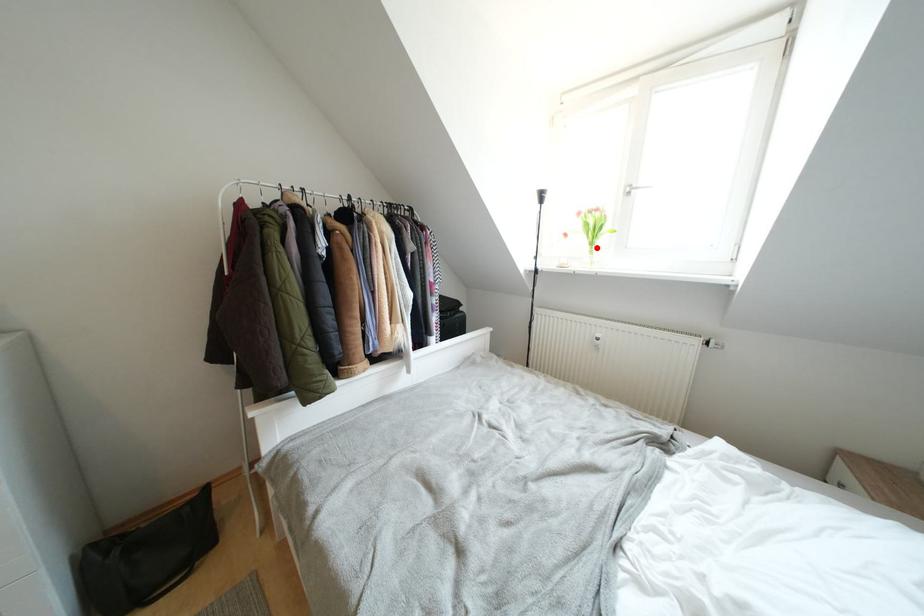
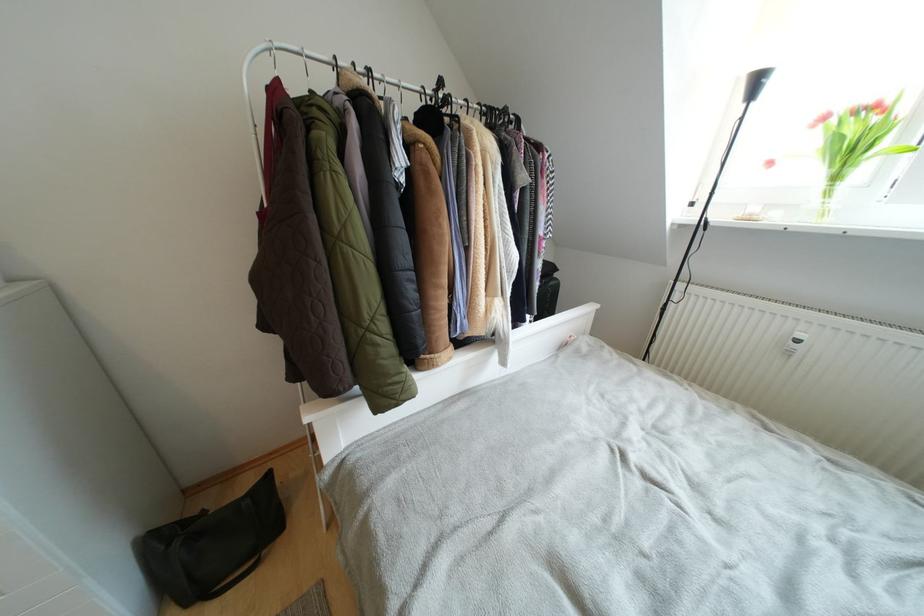
The point at the highlighted location is marked in the first image. Where is the corresponding point in the second image?

(840, 182)